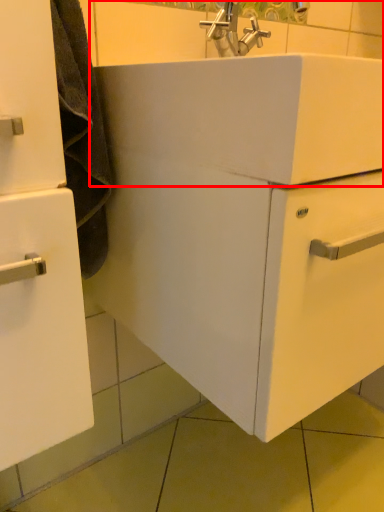
Question: Observing the image, what is the correct spatial positioning of sink (annotated by the red box) in reference to bathroom cabinet?

Choices:
 (A) left
 (B) right

Answer: (B)